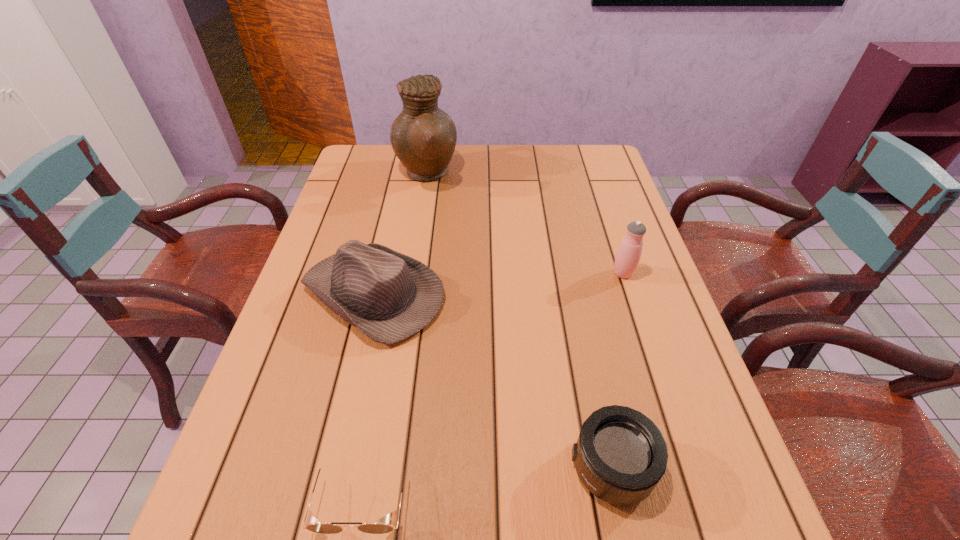
Find the location of a particular element. The height and width of the screenshot is (540, 960). the farthest object is located at coordinates (423, 137).

You are a GUI agent. You are given a task and a screenshot of the screen. Output one action in this format:
    pyautogui.click(x=<x>, y=<y>)
    Task: Click on the tallest object
    Image resolution: width=960 pixels, height=540 pixels.
    Given the screenshot: What is the action you would take?
    pyautogui.click(x=423, y=137)

In order to click on the fourth shortest object in this screenshot , I will do `click(628, 255)`.

I want to click on thermos bottle, so click(x=628, y=255).

At what (x,y) coordinates should I click in order to perform the action: click on fedora. Please return your answer as a coordinate pair (x, y). The width and height of the screenshot is (960, 540). Looking at the image, I should click on (389, 296).

Locate an element on the screen. This screenshot has height=540, width=960. telephoto lens is located at coordinates pyautogui.click(x=620, y=456).

Locate an element on the screen. The height and width of the screenshot is (540, 960). the second object from right to left is located at coordinates (620, 456).

Identify the location of the shortest object. Image resolution: width=960 pixels, height=540 pixels. (312, 524).

Identify the location of vacant space located 0.360m at the spout of the pitcher. (569, 174).

At what (x,y) coordinates should I click in order to perform the action: click on free space located 0.140m on the left of the thermos bottle. Please return your answer as a coordinate pair (x, y). The height and width of the screenshot is (540, 960). Looking at the image, I should click on (556, 273).